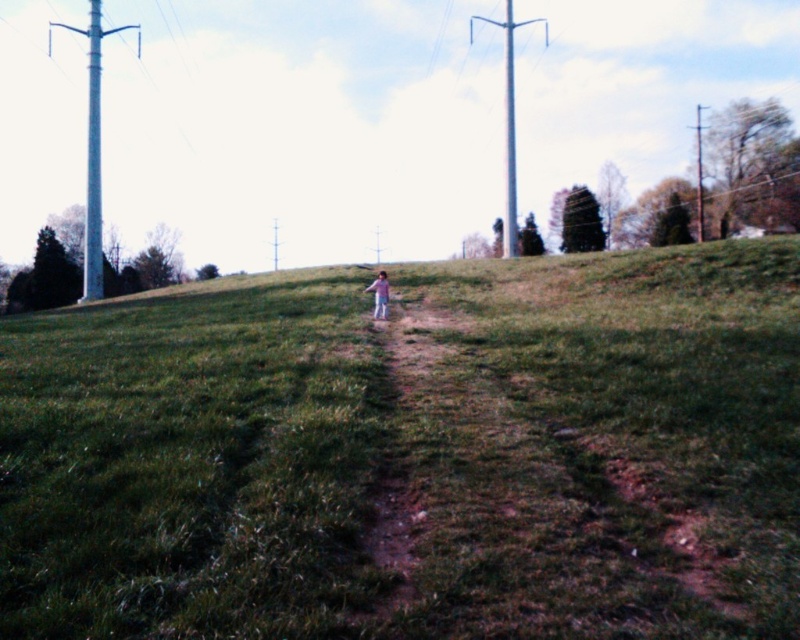
Question: Which is farther from the purple cotton shirt at center?

Choices:
 (A) dirt path at center
 (B) white metallic telegraph pole at left
 (C) green grassy hill at center
 (D) metallic gray telegraph pole at upper center

Answer: (B)

Question: Can you confirm if metallic gray telegraph pole at upper center is bigger than purple cotton shirt at center?

Choices:
 (A) no
 (B) yes

Answer: (B)

Question: Does green grassy hill at center have a lesser width compared to white metallic telegraph pole at left?

Choices:
 (A) no
 (B) yes

Answer: (B)

Question: Which object is the closest to the metallic gray telegraph pole at upper center?

Choices:
 (A) dirt path at center
 (B) white metallic telegraph pole at left
 (C) green grassy hill at center

Answer: (C)

Question: Is green grassy hill at center to the left of white metallic telegraph pole at left from the viewer's perspective?

Choices:
 (A) no
 (B) yes

Answer: (A)

Question: Which object is positioned farthest from the purple cotton shirt at center?

Choices:
 (A) metallic gray telegraph pole at upper center
 (B) white metallic telegraph pole at left

Answer: (B)